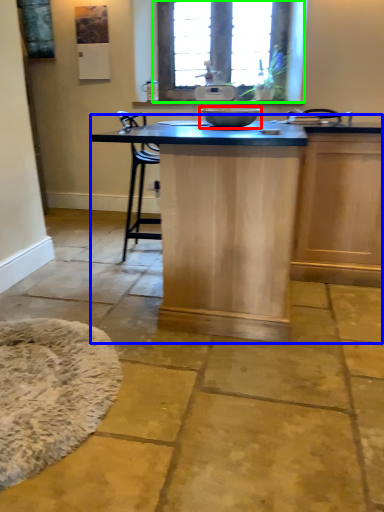
Question: Based on their relative distances, which object is farther from mixing bowl (highlighted by a red box)? Choose from table (highlighted by a blue box) and window (highlighted by a green box).

Choices:
 (A) table
 (B) window

Answer: (B)